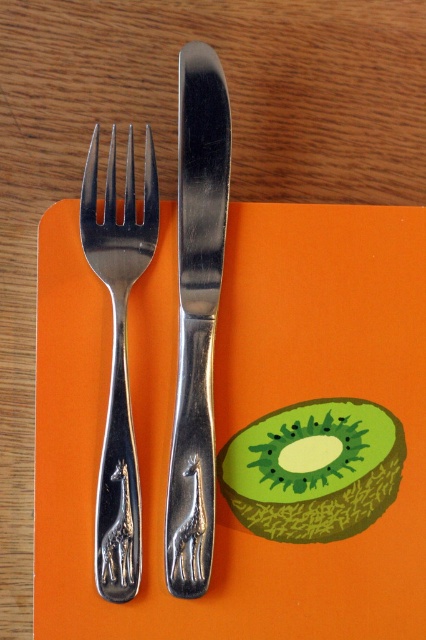
Question: Which of the following is the farthest from the observer?

Choices:
 (A) green matte kiwi at center
 (B) polished silver fork at left
 (C) polished metal knife at center

Answer: (A)

Question: Does polished metal knife at center lie in front of polished silver fork at left?

Choices:
 (A) no
 (B) yes

Answer: (A)

Question: Which point is closer to the camera?

Choices:
 (A) (287, 464)
 (B) (132, 538)
 (C) (203, 112)

Answer: (B)

Question: Based on their relative distances, which object is nearer to the green matte kiwi at center?

Choices:
 (A) polished silver fork at left
 (B) polished metal knife at center

Answer: (B)

Question: Considering the relative positions of polished metal knife at center and green matte kiwi at center in the image provided, where is polished metal knife at center located with respect to green matte kiwi at center?

Choices:
 (A) below
 (B) above

Answer: (B)

Question: Can you confirm if green matte kiwi at center is positioned to the right of polished silver fork at left?

Choices:
 (A) yes
 (B) no

Answer: (A)